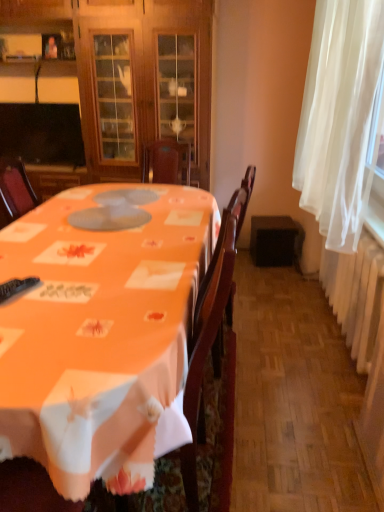
Image resolution: width=384 pixels, height=512 pixels. Identify the location of free space below white sheer curtain at right (from a real-world perspective). (303, 325).